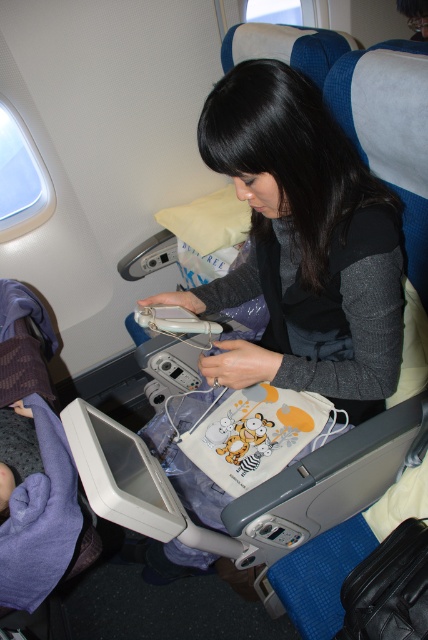
Who is positioned more to the left, matte gray sweater at center or purple soft blanket at lower left?

Positioned to the left is purple soft blanket at lower left.

Describe the element at coordinates (303, 244) in the screenshot. I see `matte gray sweater at center` at that location.

Where is `matte gray sweater at center`? The height and width of the screenshot is (640, 428). matte gray sweater at center is located at coordinates (303, 244).